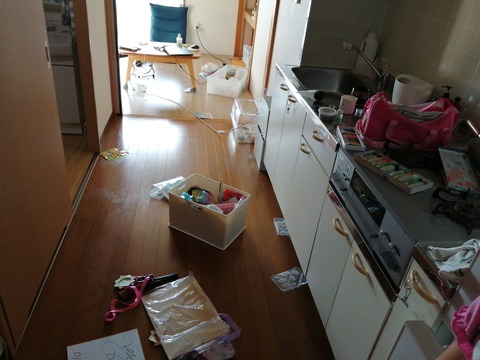
The image size is (480, 360). What are the coordinates of `floor` in the screenshot? It's located at (176, 140), (208, 98), (78, 150).